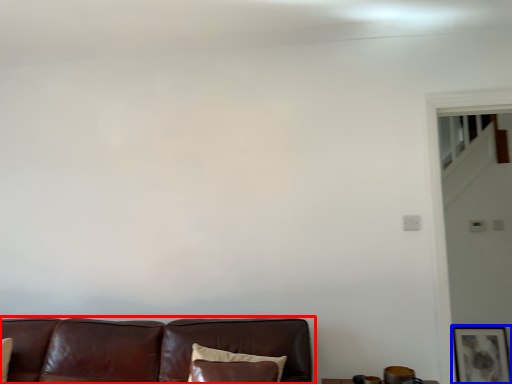
Question: Which object is closer to the camera taking this photo, studio couch (highlighted by a red box) or picture frame (highlighted by a blue box)?

Choices:
 (A) studio couch
 (B) picture frame

Answer: (A)